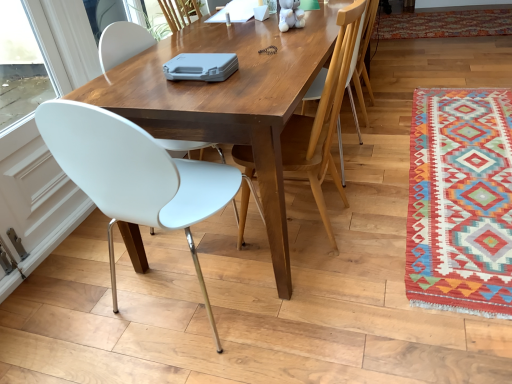
Where is `vacant space underneath multicolored woven rug at lower right, positioned as the 1th mat in bottom-to-top order (from a real-world perspective)`? This screenshot has height=384, width=512. vacant space underneath multicolored woven rug at lower right, positioned as the 1th mat in bottom-to-top order (from a real-world perspective) is located at coordinates (469, 166).